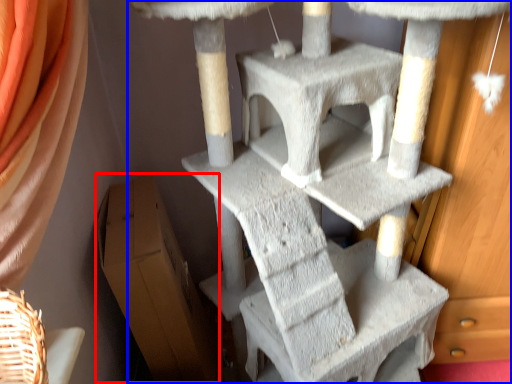
Question: Which point is further to the camera, cardboard box (highlighted by a red box) or furniture (highlighted by a blue box)?

Choices:
 (A) cardboard box
 (B) furniture

Answer: (A)